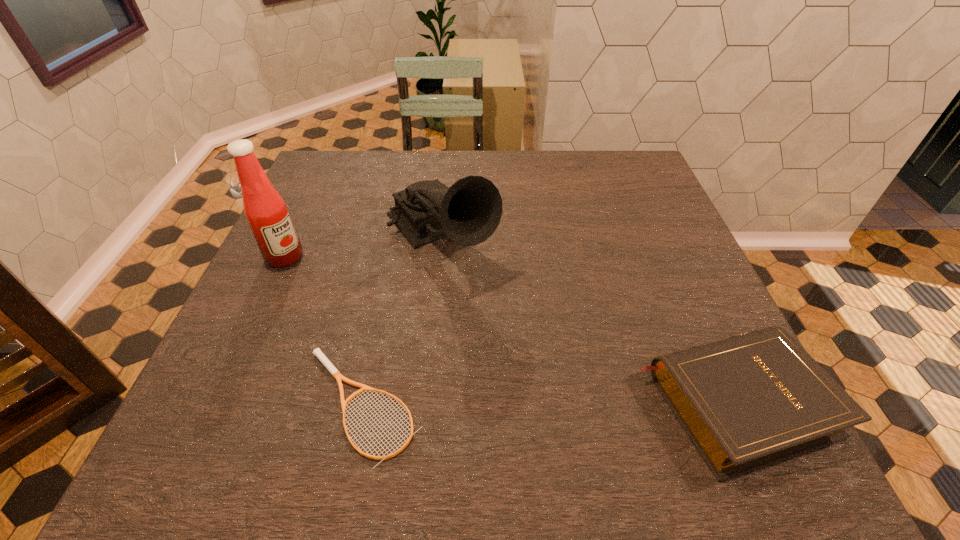
Locate an element on the screen. The width and height of the screenshot is (960, 540). free space between the second shortest object and the tennis racket is located at coordinates (548, 404).

Find the location of a particular element. free spot between the condiment and the phonograph_record is located at coordinates (362, 247).

Where is `vacant area between the leftmost object and the phonograph_record`? The image size is (960, 540). vacant area between the leftmost object and the phonograph_record is located at coordinates pos(362,247).

Identify which object is the second nearest to the third tallest object. Please provide its 2D coordinates. Your answer should be formatted as a tuple, i.e. [(x, y)], where the tuple contains the x and y coordinates of a point satisfying the conditions above.

[(330, 367)]

At what (x,y) coordinates should I click in order to perform the action: click on object that can be found as the closest to the third shortest object. Please return your answer as a coordinate pair (x, y). The width and height of the screenshot is (960, 540). Looking at the image, I should click on (330, 367).

I want to click on free space that satisfies the following two spatial constraints: 1. on the front side of the phonograph_record; 2. on the left side of the rightmost object, so click(423, 403).

Where is `vacant space that satisfies the following two spatial constraints: 1. on the front side of the second shortest object; 2. on the left side of the leftmost object`? vacant space that satisfies the following two spatial constraints: 1. on the front side of the second shortest object; 2. on the left side of the leftmost object is located at coordinates (217, 403).